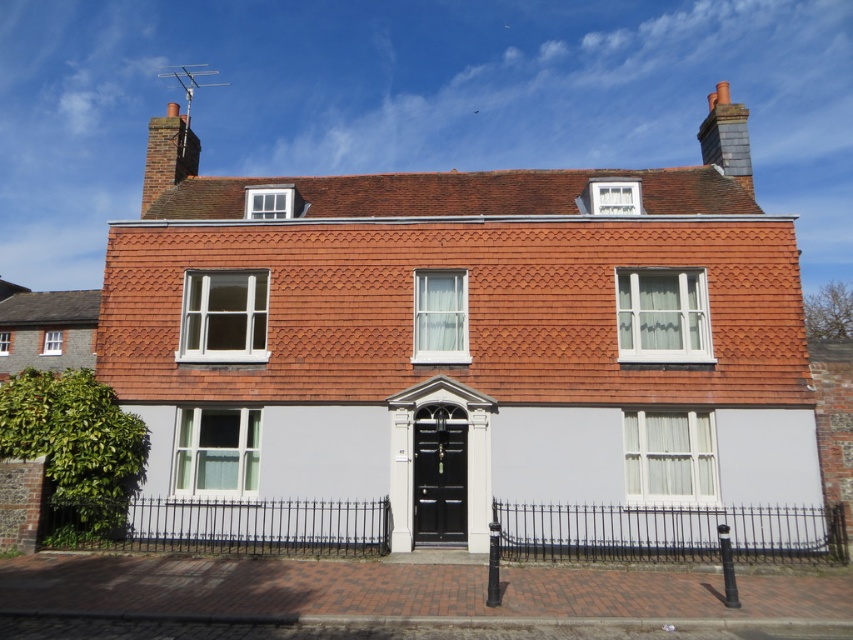
In the scene shown: You are standing in front of the two chimneys on the roof of the building. Which chimney, the red brick chimney at upper left or the gray slate chimney at upper right, is closer to you?

The red brick chimney at upper left is closer to you because it is in front of the gray slate chimney at upper right.